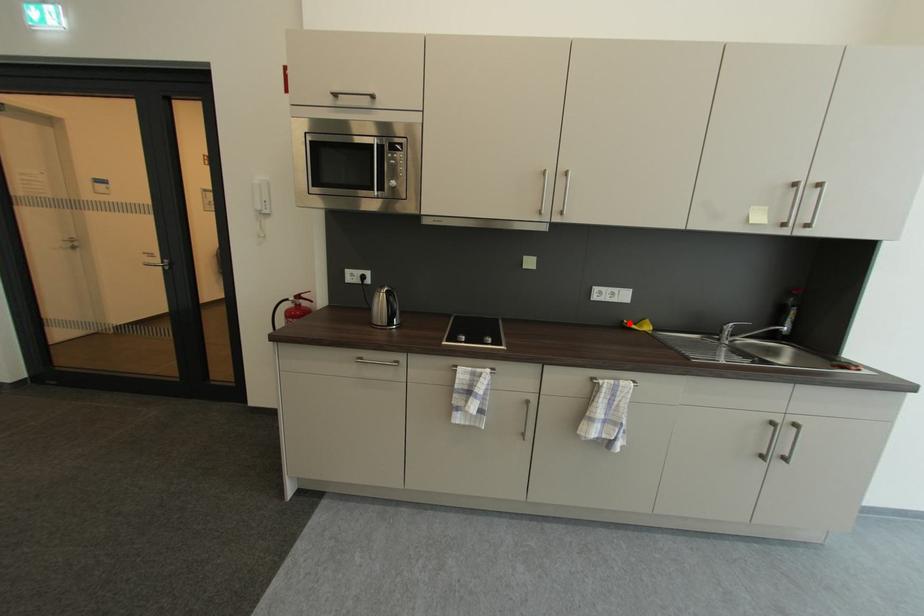
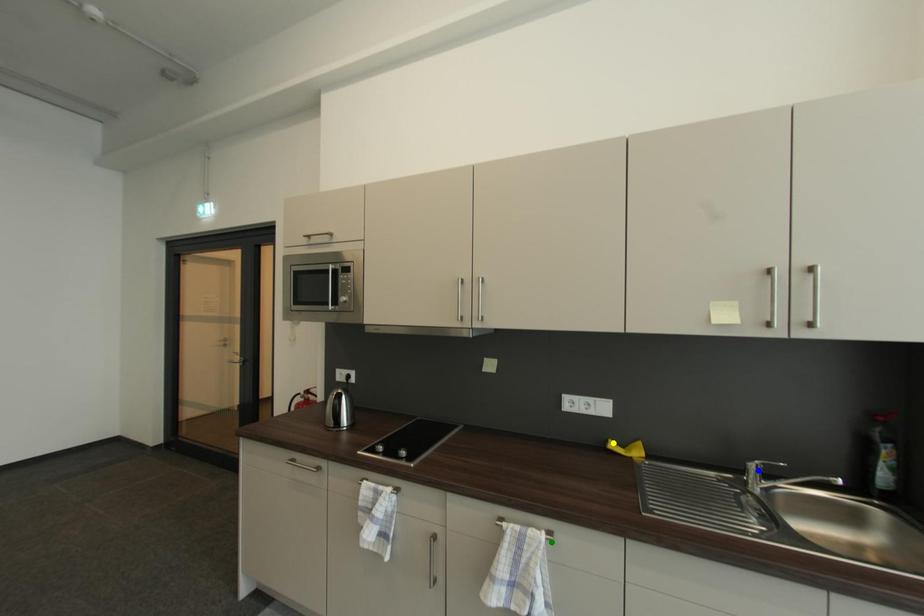
Question: I am providing you with two images of the same scene from different viewpoints. A red point is marked on the first image. You are given multiple points on the second image. Can you choose the point in image 2 that corresponds to the point in image 1?

Choices:
 (A) blue point
 (B) green point
 (C) yellow point

Answer: (C)